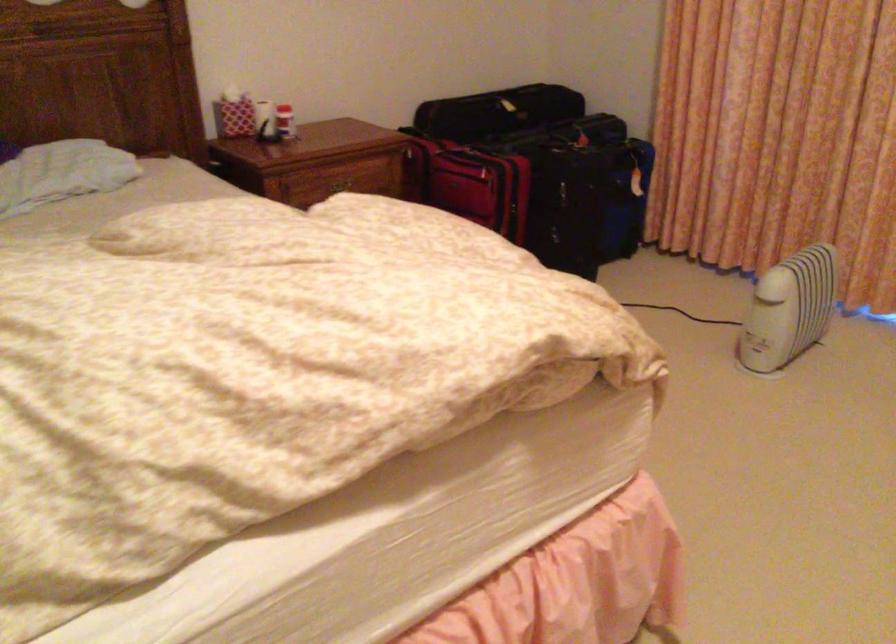
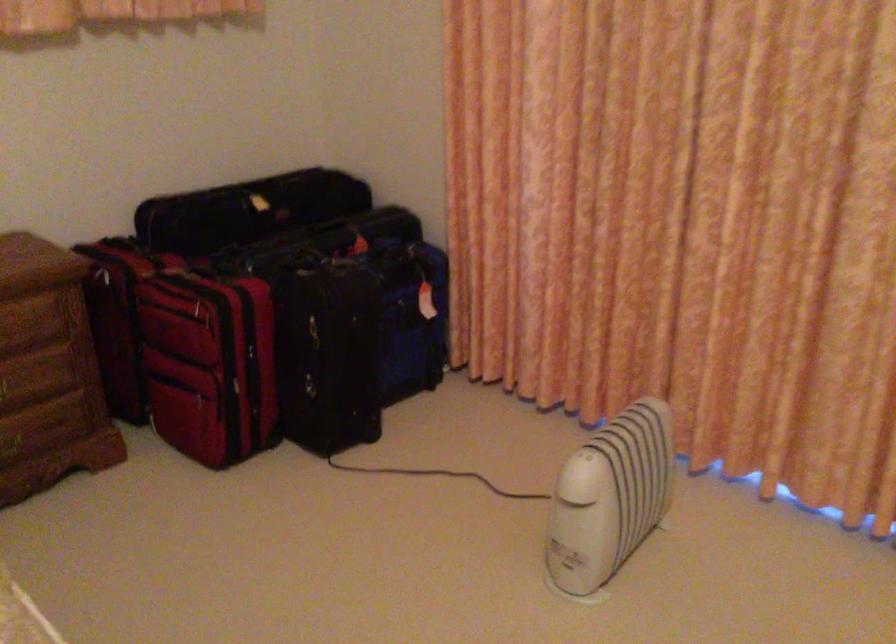
Find the pixel in the second image that matches point (495, 107) in the first image.

(247, 210)